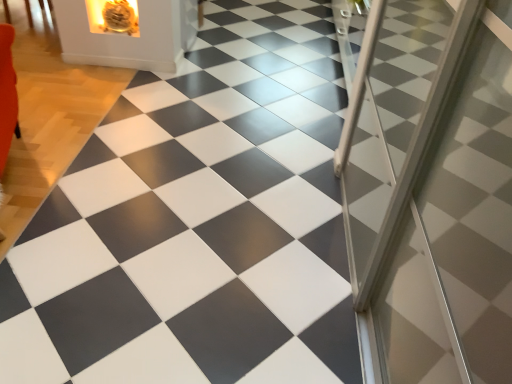
Question: Considering the relative positions of gold metallic fireplace at upper left and clear glass screen door at right in the image provided, is gold metallic fireplace at upper left to the left or to the right of clear glass screen door at right?

Choices:
 (A) left
 (B) right

Answer: (A)

Question: Does point (128, 31) appear closer or farther from the camera than point (373, 266)?

Choices:
 (A) closer
 (B) farther

Answer: (B)

Question: Choose the correct answer: Is gold metallic fireplace at upper left inside clear glass screen door at right or outside it?

Choices:
 (A) inside
 (B) outside

Answer: (B)

Question: Is clear glass screen door at right inside the boundaries of gold metallic fireplace at upper left, or outside?

Choices:
 (A) inside
 (B) outside

Answer: (B)

Question: Is clear glass screen door at right wider or thinner than gold metallic fireplace at upper left?

Choices:
 (A) wide
 (B) thin

Answer: (A)

Question: From a real-world perspective, is clear glass screen door at right physically located above or below gold metallic fireplace at upper left?

Choices:
 (A) above
 (B) below

Answer: (A)

Question: In terms of height, does clear glass screen door at right look taller or shorter compared to gold metallic fireplace at upper left?

Choices:
 (A) short
 (B) tall

Answer: (B)